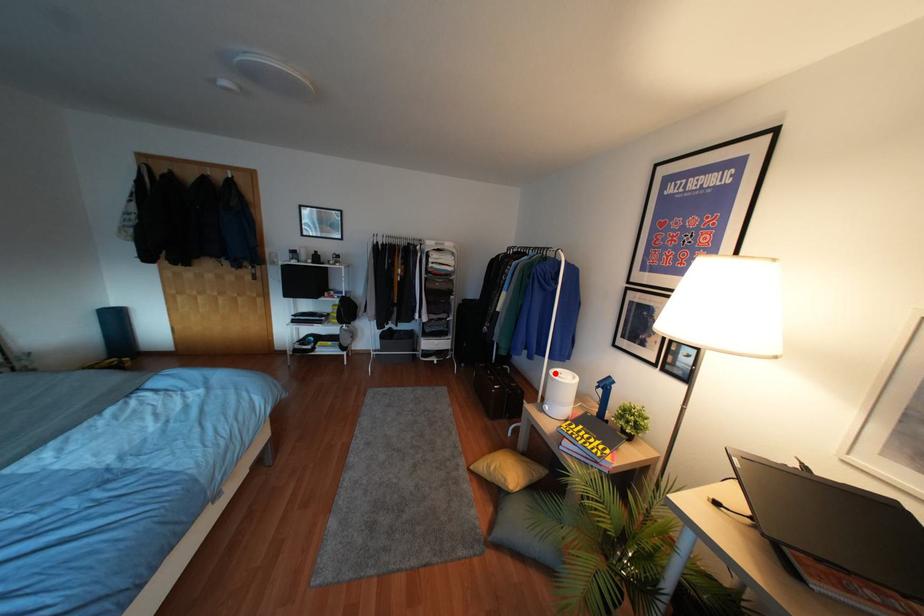
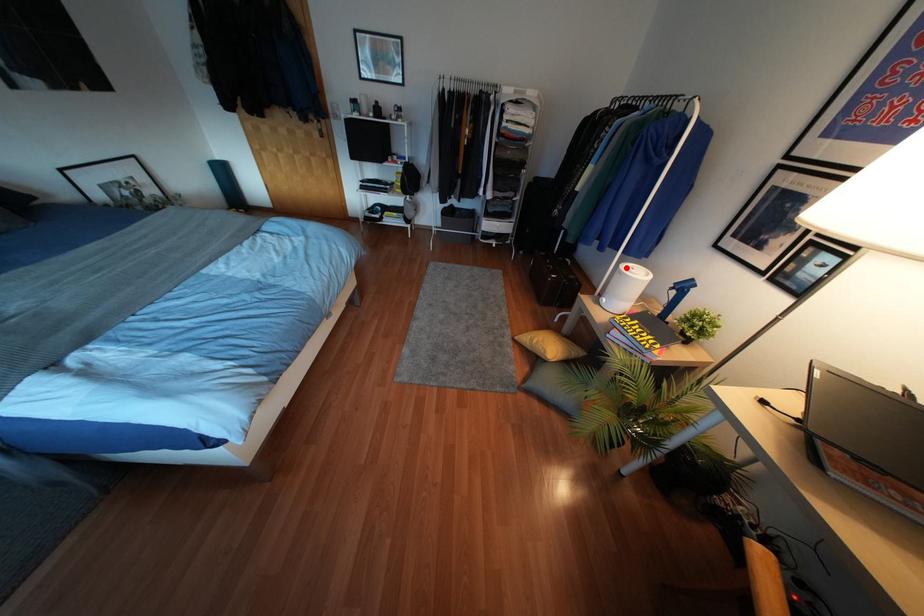
I am providing you with two images of the same scene from different viewpoints. A red point is marked on the first image and another point is marked on the second image. Do the highlighted points in image1 and image2 indicate the same real-world spot?

Yes